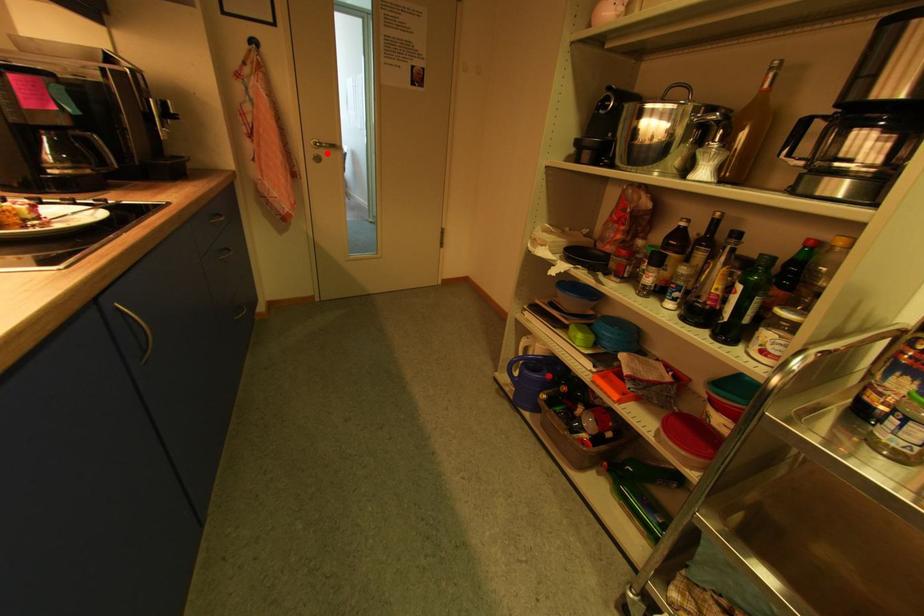
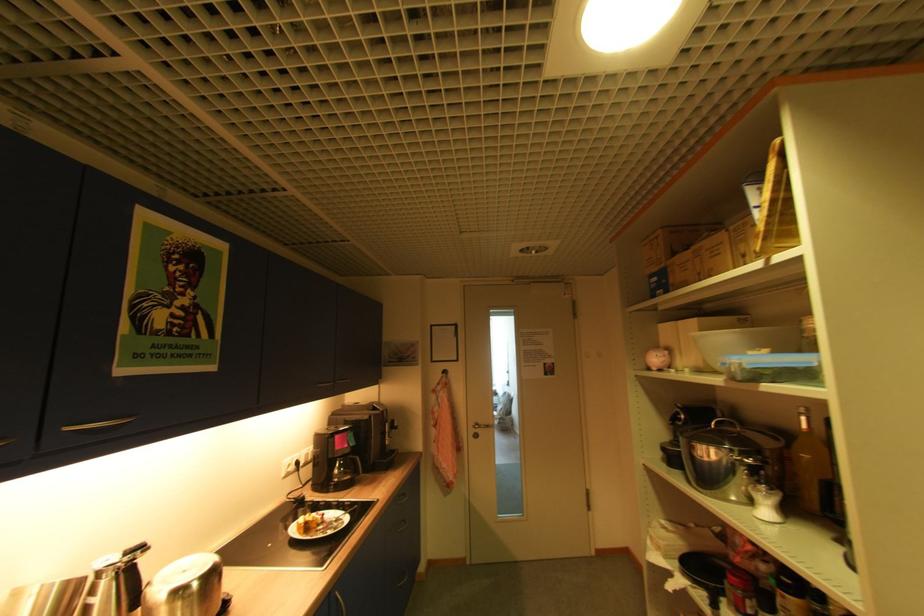
Locate, in the second image, the point that corresponds to the highlighted location in the first image.

(484, 431)